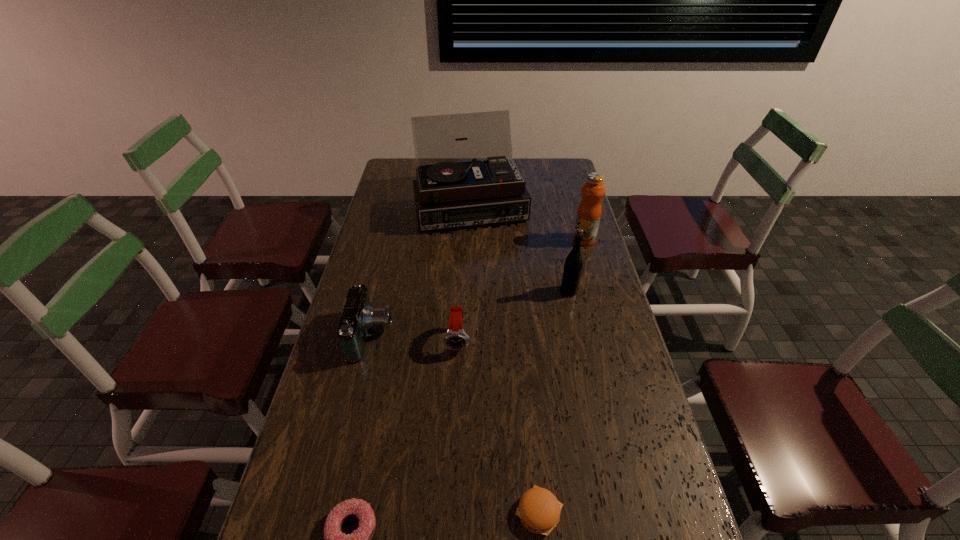
Identify the location of record player. (454, 189).

Find the location of `fruit juice`. fruit juice is located at coordinates (589, 211).

Locate an element on the screen. The width and height of the screenshot is (960, 540). beer bottle is located at coordinates (573, 266).

You are a GUI agent. You are given a task and a screenshot of the screen. Output one action in this format:
    pyautogui.click(x=<x>, y=<y>)
    Task: Click on the third farthest object
    The image size is (960, 540).
    Given the screenshot: What is the action you would take?
    pyautogui.click(x=573, y=266)

You are a GUI agent. You are given a task and a screenshot of the screen. Output one action in this format:
    pyautogui.click(x=<x>, y=<y>)
    Task: Click on the camcorder
    This screenshot has height=540, width=960.
    Given the screenshot: What is the action you would take?
    pyautogui.click(x=359, y=316)

The width and height of the screenshot is (960, 540). Identify the location of watch. (455, 338).

In order to click on patty in this screenshot , I will do `click(539, 510)`.

Locate an element on the screen. The height and width of the screenshot is (540, 960). free space located on the left of the record player is located at coordinates (391, 207).

I want to click on free location located on the front of the fruit juice, so click(x=598, y=289).

What are the coordinates of `free location located 0.400m on the back of the beer bottle` in the screenshot? It's located at (553, 218).